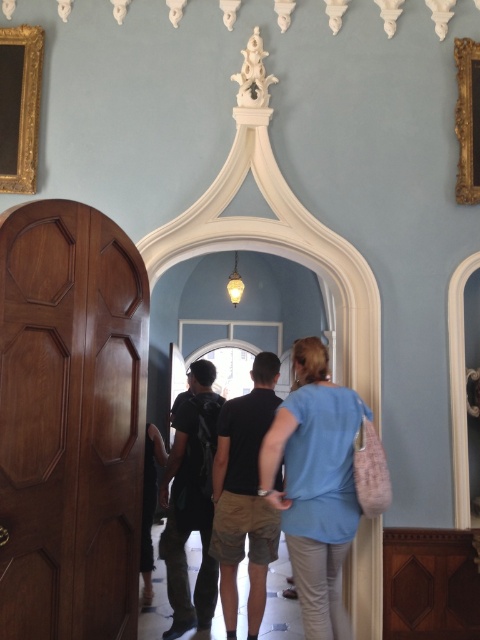
Question: Does black cotton shirt at center appear on the right side of black fabric backpack at center?

Choices:
 (A) no
 (B) yes

Answer: (B)

Question: Can you confirm if polished wood door at left is positioned above blue cotton shirt at center?

Choices:
 (A) no
 (B) yes

Answer: (B)

Question: Estimate the real-world distances between objects in this image. Which object is closer to the gold textured chandelier at center?

Choices:
 (A) blue cotton shirt at center
 (B) gold ornate frame at upper left
 (C) gold wood picture frame at right

Answer: (B)

Question: Based on their relative distances, which object is farther from the black fabric backpack at center?

Choices:
 (A) black cotton shirt at center
 (B) polished wood door at left
 (C) gold wood picture frame at right
 (D) gold ornate frame at upper left

Answer: (C)

Question: Does polished wood door at left appear on the left side of gold wood picture frame at right?

Choices:
 (A) no
 (B) yes

Answer: (B)

Question: Which object is positioned closest to the black fabric backpack at center?

Choices:
 (A) black cotton shirt at center
 (B) gold textured chandelier at center

Answer: (A)